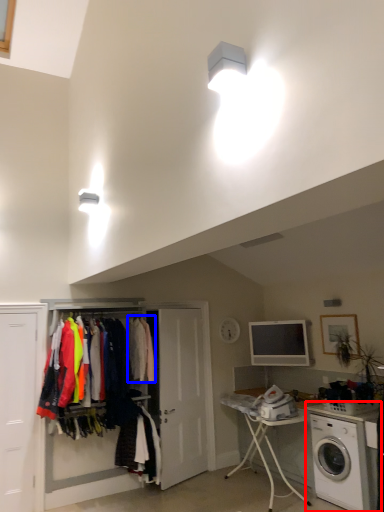
Question: Which object appears farthest to the camera in this image, washing machine (highlighted by a red box) or clothing (highlighted by a blue box)?

Choices:
 (A) washing machine
 (B) clothing

Answer: (B)